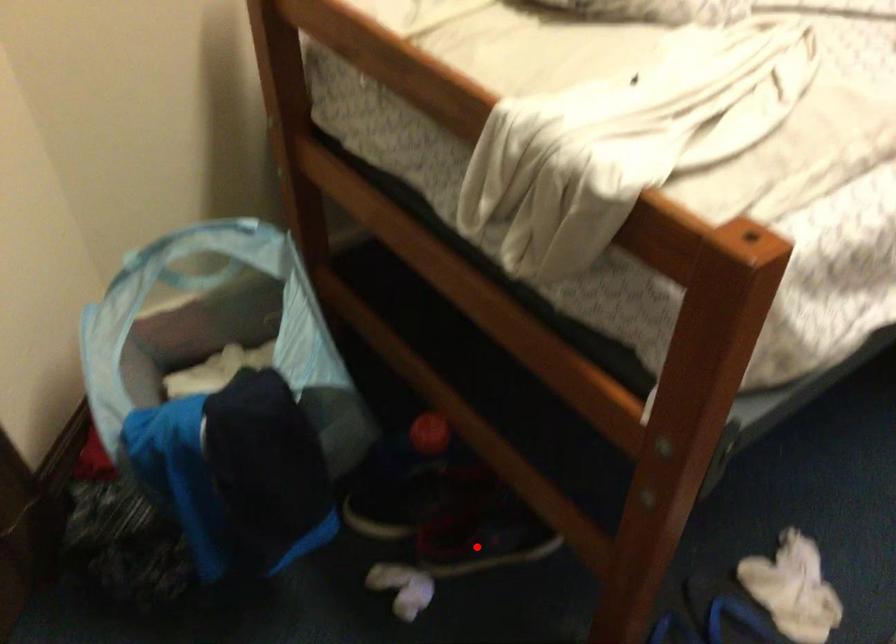
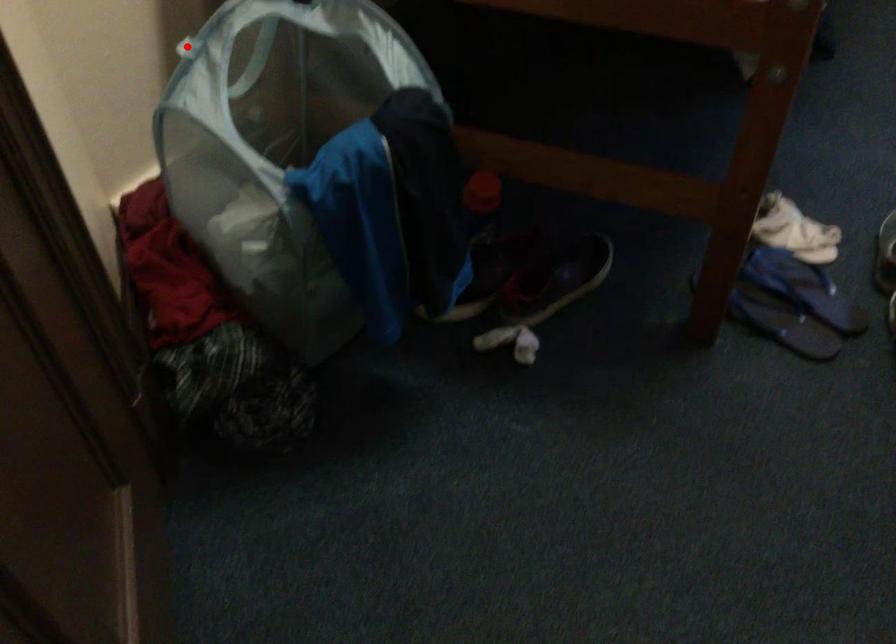
I am providing you with two images of the same scene from different viewpoints. A red point is marked on the first image and another point is marked on the second image. Do the highlighted points in image1 and image2 indicate the same real-world spot?

No